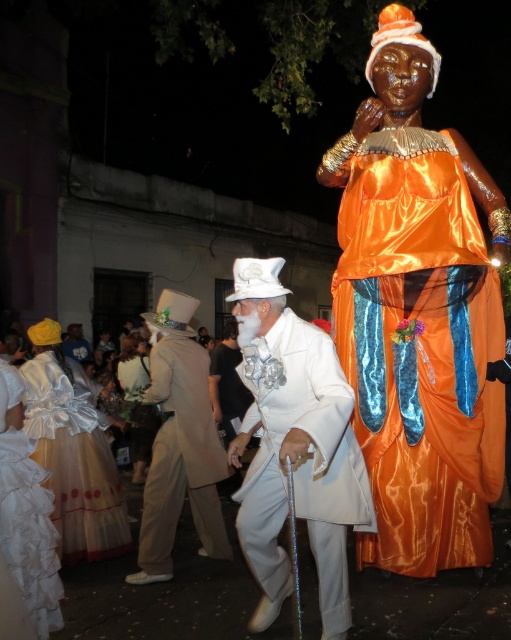
Is tan fabric top hat at center smaller than white satin top hat at upper center?

Actually, tan fabric top hat at center might be larger than white satin top hat at upper center.

Is point (197, 401) more distant than point (64, 349)?

No.

Is point (208, 394) positioned in front of point (64, 346)?

Yes, it is.

The width and height of the screenshot is (511, 640). Identify the location of tan fabric top hat at center. (179, 444).

Does white satin dress at lower left come behind white satin dress at center?

No, it is not.

Is point (34, 385) farther from camera compared to point (136, 394)?

No, it is not.

I want to click on white satin dress at lower left, so click(73, 451).

Does white satin dress at lower left have a larger size compared to white ruffled dress at lower left?

Correct, white satin dress at lower left is larger in size than white ruffled dress at lower left.

Does white satin dress at lower left have a lesser width compared to white ruffled dress at lower left?

In fact, white satin dress at lower left might be wider than white ruffled dress at lower left.

The height and width of the screenshot is (640, 511). What are the coordinates of `white satin dress at lower left` in the screenshot? It's located at pos(73,451).

Where is `white satin dress at lower left`? The width and height of the screenshot is (511, 640). white satin dress at lower left is located at coordinates (73, 451).